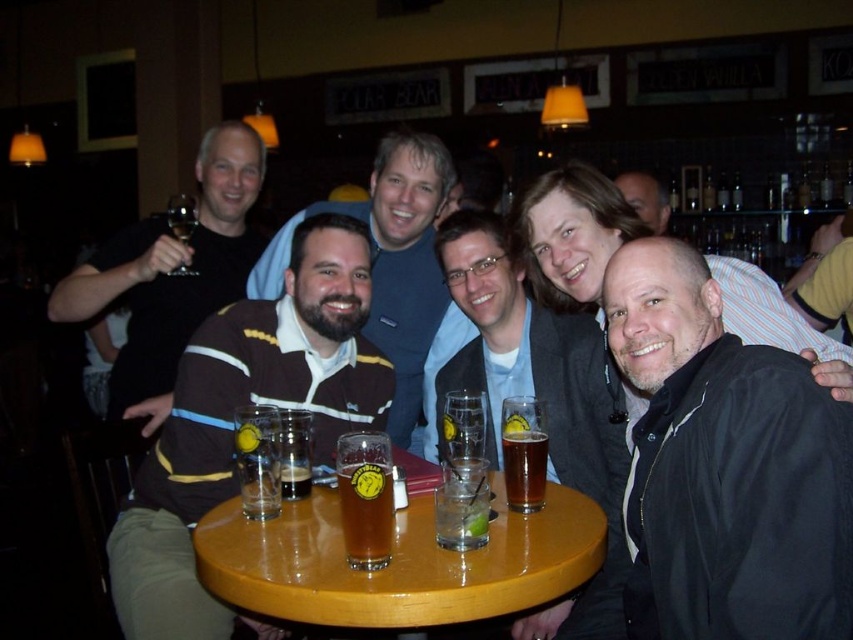
Question: Is brown striped sweater at center to the right of translucent glass mug at center from the viewer's perspective?

Choices:
 (A) yes
 (B) no

Answer: (B)

Question: Which is farther from the clear glass at table center?

Choices:
 (A) black jersey at left
 (B) smooth leather jacket at center

Answer: (B)

Question: Which point is closer to the camera taking this photo?

Choices:
 (A) (660, 221)
 (B) (363, 396)
 (C) (840, 508)

Answer: (C)

Question: Is clear glass at table center bigger than dark amber glass at table center?

Choices:
 (A) no
 (B) yes

Answer: (B)

Question: Which point is farther to the camera?

Choices:
 (A) (535, 481)
 (B) (258, 156)

Answer: (B)

Question: Is the position of wooden table at center more distant than that of black jersey at left?

Choices:
 (A) yes
 (B) no

Answer: (B)